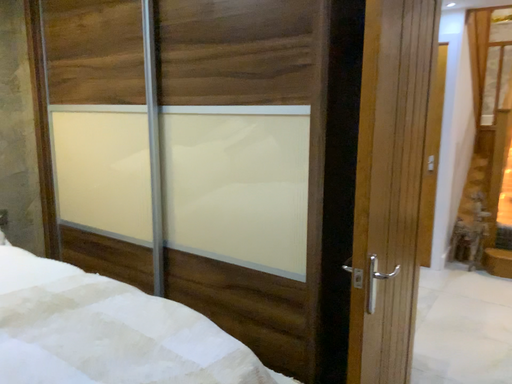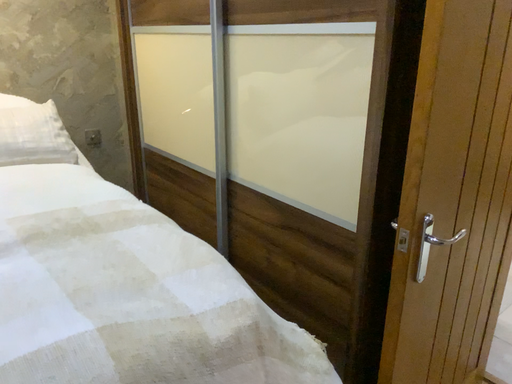
Question: How did the camera likely rotate when shooting the video?

Choices:
 (A) rotated right
 (B) rotated left

Answer: (B)